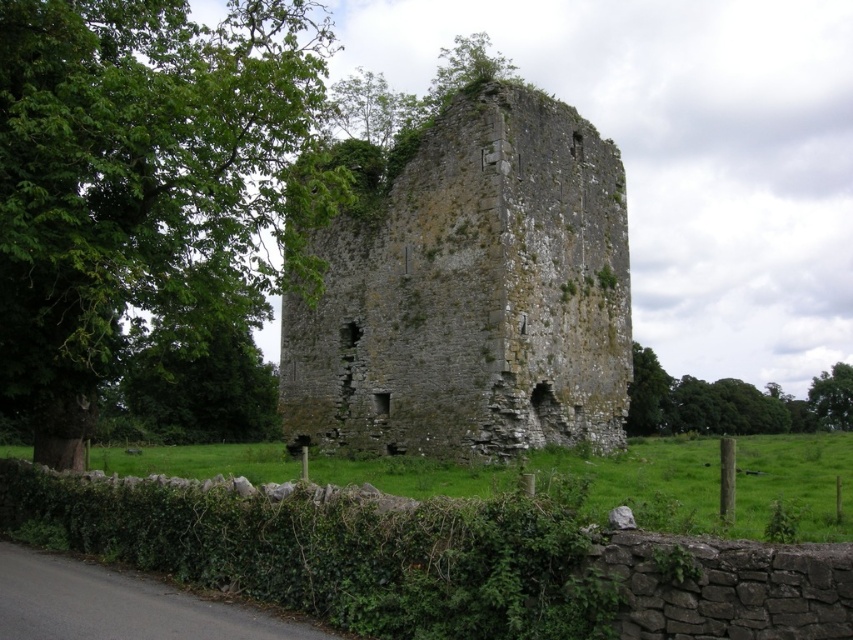
What do you see at coordinates (471, 294) in the screenshot?
I see `stone tower at center` at bounding box center [471, 294].

Between stone tower at center and green leafy tree at right, which one appears on the left side from the viewer's perspective?

From the viewer's perspective, stone tower at center appears more on the left side.

Where is `stone tower at center`? stone tower at center is located at coordinates (471, 294).

What do you see at coordinates (471, 294) in the screenshot? This screenshot has width=853, height=640. I see `stone tower at center` at bounding box center [471, 294].

Can you confirm if stone tower at center is smaller than green leafy tree at upper center?

Incorrect, stone tower at center is not smaller in size than green leafy tree at upper center.

Is point (354, 378) more distant than point (830, 369)?

No.

I want to click on stone tower at center, so click(471, 294).

Consider the image. Can you confirm if green leafy tree at upper left is positioned to the right of green leafy tree at upper center?

No, green leafy tree at upper left is not to the right of green leafy tree at upper center.

Does green leafy tree at upper left have a lesser width compared to green leafy tree at upper center?

No.

Is point (227, 308) farther from viewer compared to point (839, 369)?

No, it is in front of (839, 369).

Identify the location of green leafy tree at upper left. (140, 182).